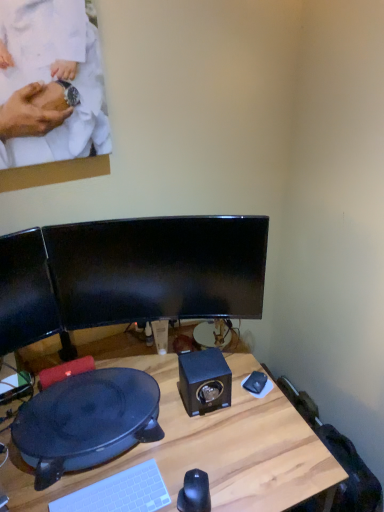
Question: Is black glossy mouse at lower center to the right of black matte speaker at center from the viewer's perspective?

Choices:
 (A) no
 (B) yes

Answer: (A)

Question: Can you confirm if black glossy mouse at lower center is smaller than black matte speaker at center?

Choices:
 (A) no
 (B) yes

Answer: (B)

Question: From the image's perspective, is black glossy mouse at lower center over black matte speaker at center?

Choices:
 (A) yes
 (B) no

Answer: (B)

Question: Is black glossy mouse at lower center taller than black matte speaker at center?

Choices:
 (A) no
 (B) yes

Answer: (A)

Question: Is black glossy mouse at lower center outside of black matte speaker at center?

Choices:
 (A) yes
 (B) no

Answer: (A)

Question: In the image, is black glossy monitor at center on the left side or the right side of black plastic wok at lower left?

Choices:
 (A) right
 (B) left

Answer: (A)

Question: From a real-world perspective, relative to black plastic wok at lower left, is black glossy monitor at center vertically above or below?

Choices:
 (A) below
 (B) above

Answer: (B)

Question: From the image's perspective, is black glossy monitor at center located above or below black plastic wok at lower left?

Choices:
 (A) below
 (B) above

Answer: (B)

Question: Is black glossy monitor at center taller or shorter than black plastic wok at lower left?

Choices:
 (A) short
 (B) tall

Answer: (B)

Question: Considering the positions of wooden desk at center and black plastic wok at lower left in the image, is wooden desk at center wider or thinner than black plastic wok at lower left?

Choices:
 (A) wide
 (B) thin

Answer: (A)

Question: Considering the positions of wooden desk at center and black plastic wok at lower left in the image, is wooden desk at center bigger or smaller than black plastic wok at lower left?

Choices:
 (A) small
 (B) big

Answer: (B)

Question: In the image, is wooden desk at center positioned in front of or behind black plastic wok at lower left?

Choices:
 (A) front
 (B) behind

Answer: (A)

Question: Considering the positions of wooden desk at center and black plastic wok at lower left in the image, is wooden desk at center taller or shorter than black plastic wok at lower left?

Choices:
 (A) short
 (B) tall

Answer: (B)

Question: Choose the correct answer: Is wooden desk at center inside black matte speaker at center or outside it?

Choices:
 (A) outside
 (B) inside

Answer: (A)

Question: From a real-world perspective, is wooden desk at center positioned above or below black matte speaker at center?

Choices:
 (A) above
 (B) below

Answer: (B)